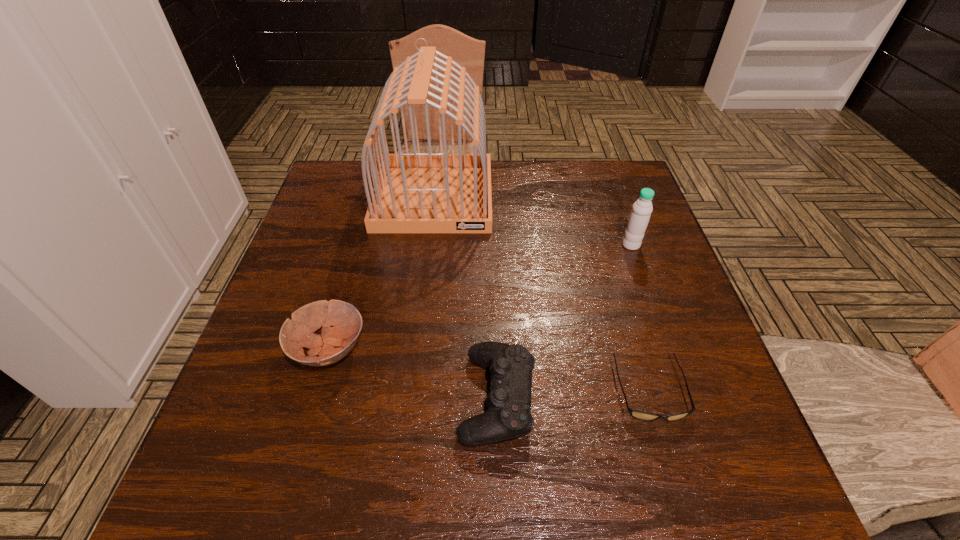
Image resolution: width=960 pixels, height=540 pixels. In order to click on vacant space at the far right corner of the desktop in this screenshot , I will do `click(598, 182)`.

I want to click on vacant region between the bowl and the fourth nearest object, so click(480, 297).

Find the location of a particular element. free space that is in between the farthest object and the control is located at coordinates (466, 296).

Find the location of `free space between the sunglasses and the fourth nearest object`. free space between the sunglasses and the fourth nearest object is located at coordinates (640, 318).

Where is `free space between the farthest object and the bowl`? free space between the farthest object and the bowl is located at coordinates (382, 273).

Where is `free space between the shortest object and the fourth shortest object`? The image size is (960, 540). free space between the shortest object and the fourth shortest object is located at coordinates (640, 318).

Find the location of a particular element. The image size is (960, 540). vacant region between the bowl and the farthest object is located at coordinates (382, 273).

Find the location of a particular element. vacant region between the bowl and the tallest object is located at coordinates (382, 273).

At what (x,y) coordinates should I click in order to perform the action: click on vacant space in between the sunglasses and the control. Please return your answer as a coordinate pair (x, y). The image size is (960, 540). Looking at the image, I should click on (573, 394).

Image resolution: width=960 pixels, height=540 pixels. In order to click on vacant region between the control and the fourth nearest object in this screenshot , I will do `click(564, 321)`.